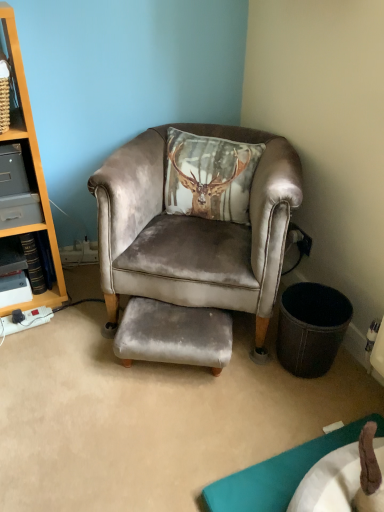
I want to click on free space in front of velvet grey chair at center, so click(172, 420).